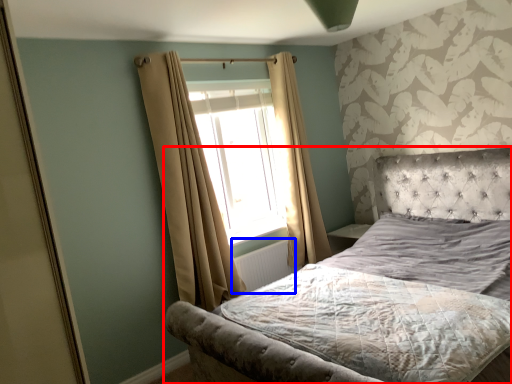
Question: Among these objects, which one is nearest to the camera, bed (highlighted by a red box) or radiator (highlighted by a blue box)?

Choices:
 (A) bed
 (B) radiator

Answer: (A)